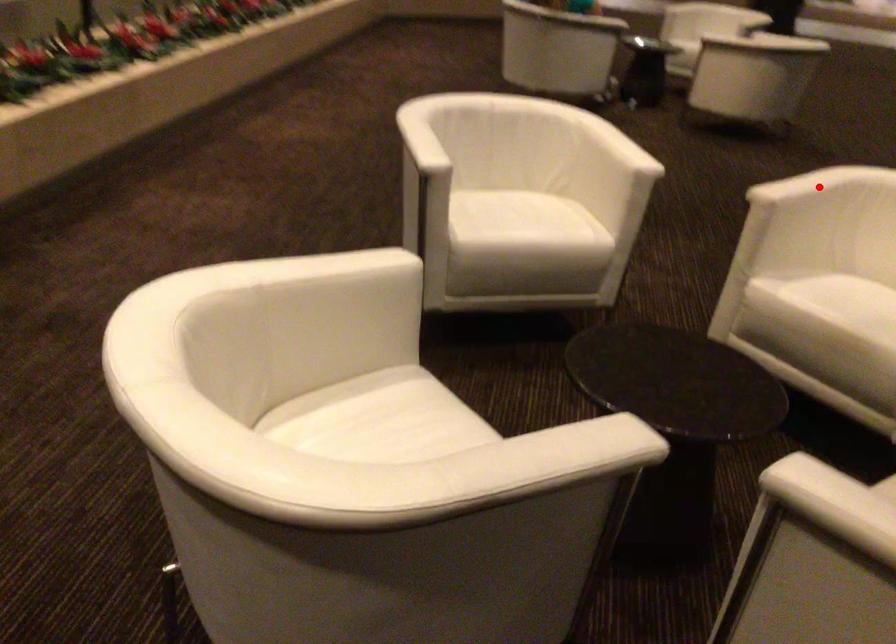
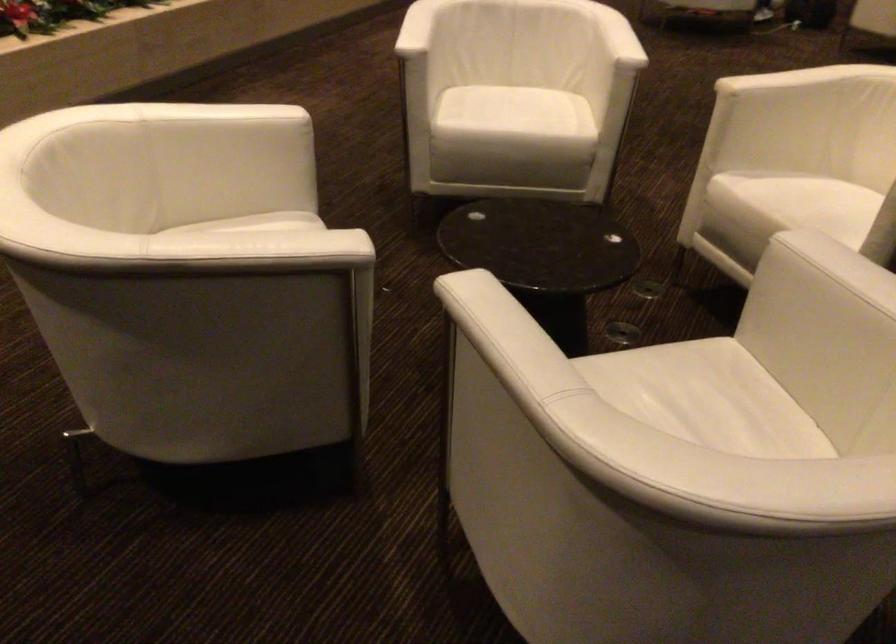
Find the pixel in the second image that matches the highlighted location in the first image.

(789, 80)